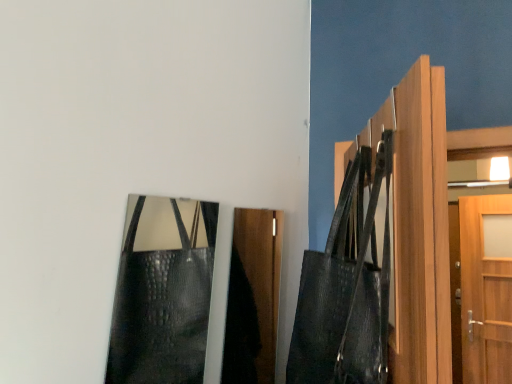
What are the coordinates of `shiny black leather bag at lower left` in the screenshot? It's located at [x=163, y=292].

I want to click on light brown wood door at right, so click(x=418, y=226).

Describe the element at coordinates (418, 226) in the screenshot. I see `light brown wood door at right` at that location.

Locate an element on the screen. This screenshot has height=384, width=512. leather textured shoulder bag at upper right is located at coordinates (346, 288).

From a real-world perspective, between leather textured shoulder bag at upper right and light brown wood door at right, who is vertically higher?

light brown wood door at right, from a real-world perspective.

How many degrees apart are the facing directions of leather textured shoulder bag at upper right and light brown wood door at right?

1.02 degrees.

Consider the image. Would you say light brown wood door at right is part of leather textured shoulder bag at upper right's contents?

No, leather textured shoulder bag at upper right does not contain light brown wood door at right.

Considering their positions, is leather textured shoulder bag at upper right located in front of or behind light brown wood door at right?

In the image, leather textured shoulder bag at upper right appears behind light brown wood door at right.

Is leather textured shoulder bag at upper right positioned beyond the bounds of shiny black leather bag at lower left?

Absolutely, leather textured shoulder bag at upper right is external to shiny black leather bag at lower left.

Is shiny black leather bag at lower left at the back of leather textured shoulder bag at upper right?

Yes, shiny black leather bag at lower left is at the back of leather textured shoulder bag at upper right.

Considering the sizes of objects leather textured shoulder bag at upper right and shiny black leather bag at lower left in the image provided, who is bigger, leather textured shoulder bag at upper right or shiny black leather bag at lower left?

leather textured shoulder bag at upper right.

From a real-world perspective, is leather textured shoulder bag at upper right physically above shiny black leather bag at lower left?

Yes.

From a real-world perspective, is light brown wood door at right below shiny black leather bag at lower left?

No.

Does light brown wood door at right contain shiny black leather bag at lower left?

No.

From the picture: Which of these two, light brown wood door at right or shiny black leather bag at lower left, is wider?

With larger width is light brown wood door at right.

Is light brown wood door at right in front of shiny black leather bag at lower left?

Yes, light brown wood door at right is closer to the camera.

From the image's perspective, which one is positioned lower, light brown wood door at right or leather textured shoulder bag at upper right?

From the image's view, leather textured shoulder bag at upper right is below.

At what (x,y) coordinates should I click in order to perform the action: click on door on the right of leather textured shoulder bag at upper right. Please return your answer as a coordinate pair (x, y). The width and height of the screenshot is (512, 384). Looking at the image, I should click on (418, 226).

Who is smaller, light brown wood door at right or leather textured shoulder bag at upper right?

Smaller between the two is light brown wood door at right.

Relative to leather textured shoulder bag at upper right, is light brown wood door at right in front or behind?

Visually, light brown wood door at right is located in front of leather textured shoulder bag at upper right.

Is point (130, 236) in front of point (300, 303)?

No.

Where is `shoulder bag that appears on the right of shiny black leather bag at lower left`? The height and width of the screenshot is (384, 512). shoulder bag that appears on the right of shiny black leather bag at lower left is located at coordinates click(346, 288).

Does shiny black leather bag at lower left have a lesser height compared to leather textured shoulder bag at upper right?

Correct, shiny black leather bag at lower left is not as tall as leather textured shoulder bag at upper right.

The width and height of the screenshot is (512, 384). What are the coordinates of `door located on the right of shiny black leather bag at lower left` in the screenshot? It's located at (418, 226).

From a real-world perspective, which is physically below, shiny black leather bag at lower left or light brown wood door at right?

shiny black leather bag at lower left is physically lower.

Does shiny black leather bag at lower left have a lesser height compared to light brown wood door at right?

Indeed, shiny black leather bag at lower left has a lesser height compared to light brown wood door at right.

Identify the location of door above the leather textured shoulder bag at upper right (from the image's perspective). (418, 226).

At what (x,y) coordinates should I click in order to perform the action: click on shoulder bag above the shiny black leather bag at lower left (from a real-world perspective). Please return your answer as a coordinate pair (x, y). This screenshot has height=384, width=512. Looking at the image, I should click on (346, 288).

Looking at the image, which one is located closer to shiny black leather bag at lower left, light brown wood door at right or leather textured shoulder bag at upper right?

leather textured shoulder bag at upper right.

When comparing their distances from light brown wood door at right, does leather textured shoulder bag at upper right or shiny black leather bag at lower left seem further?

shiny black leather bag at lower left is further to light brown wood door at right.

Looking at the image, which one is located closer to leather textured shoulder bag at upper right, shiny black leather bag at lower left or light brown wood door at right?

light brown wood door at right.

From the image, which object appears to be farther from light brown wood door at right, shiny black leather bag at lower left or leather textured shoulder bag at upper right?

shiny black leather bag at lower left is further to light brown wood door at right.

Estimate the real-world distances between objects in this image. Which object is further from shiny black leather bag at lower left, leather textured shoulder bag at upper right or light brown wood door at right?

light brown wood door at right.

Consider the image. From the image, which object appears to be farther from leather textured shoulder bag at upper right, light brown wood door at right or shiny black leather bag at lower left?

shiny black leather bag at lower left is further to leather textured shoulder bag at upper right.

Image resolution: width=512 pixels, height=384 pixels. Find the location of `shoulder bag between shiny black leather bag at lower left and light brown wood door at right`. shoulder bag between shiny black leather bag at lower left and light brown wood door at right is located at coordinates (346, 288).